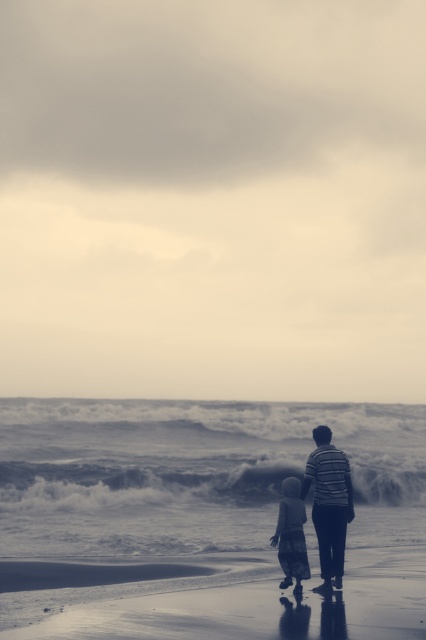
Which of these two, smooth sand at lower center or light gray cotton dress at lower center, stands shorter?

With less height is smooth sand at lower center.

Based on the photo, who is positioned more to the left, smooth sand at lower center or light gray cotton dress at lower center?

Positioned to the left is light gray cotton dress at lower center.

Who is more forward, [252,618] or [270,540]?

Point [252,618] is more forward.

Where is `smooth sand at lower center`? The width and height of the screenshot is (426, 640). smooth sand at lower center is located at coordinates (238, 604).

Is smooth sand at lower center smaller than striped fabric at center?

Yes, smooth sand at lower center is smaller than striped fabric at center.

Can you confirm if smooth sand at lower center is bigger than striped fabric at center?

No.

Which is in front, point (389, 614) or point (322, 550)?

Positioned in front is point (389, 614).

In order to click on smooth sand at lower center in this screenshot , I will do `click(238, 604)`.

Is point (351, 520) positioned after point (302, 548)?

Yes, it is behind point (302, 548).

Is striped fabric at center above light gray cotton dress at lower center?

Indeed, striped fabric at center is positioned over light gray cotton dress at lower center.

Locate an element on the screen. This screenshot has width=426, height=640. striped fabric at center is located at coordinates [328, 504].